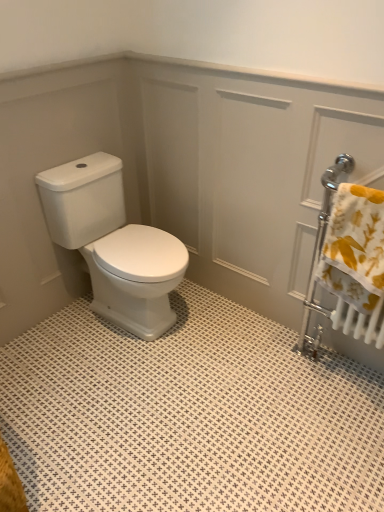
Question: Is white glossy toilet at center facing away from white glossy screen door at center?

Choices:
 (A) yes
 (B) no

Answer: (B)

Question: Does white glossy toilet at center come behind white glossy screen door at center?

Choices:
 (A) no
 (B) yes

Answer: (B)

Question: From the image's perspective, is white glossy toilet at center located beneath white glossy screen door at center?

Choices:
 (A) yes
 (B) no

Answer: (A)

Question: Considering the relative sizes of white glossy toilet at center and white glossy screen door at center in the image provided, is white glossy toilet at center thinner than white glossy screen door at center?

Choices:
 (A) yes
 (B) no

Answer: (B)

Question: Would you say white glossy screen door at center is part of white glossy toilet at center's contents?

Choices:
 (A) yes
 (B) no

Answer: (B)

Question: Considering the positions of yellow floral fabric at right and white glossy toilet at center in the image, is yellow floral fabric at right taller or shorter than white glossy toilet at center?

Choices:
 (A) short
 (B) tall

Answer: (A)

Question: Is yellow floral fabric at right situated inside white glossy toilet at center or outside?

Choices:
 (A) outside
 (B) inside

Answer: (A)

Question: Is yellow floral fabric at right in front of or behind white glossy toilet at center in the image?

Choices:
 (A) front
 (B) behind

Answer: (A)

Question: Is yellow floral fabric at right to the left or to the right of white glossy toilet at center in the image?

Choices:
 (A) left
 (B) right

Answer: (B)

Question: From their relative heights in the image, would you say white glossy toilet at center is taller or shorter than yellow floral fabric at right?

Choices:
 (A) tall
 (B) short

Answer: (A)

Question: Looking at their shapes, would you say white glossy toilet at center is wider or thinner than yellow floral fabric at right?

Choices:
 (A) wide
 (B) thin

Answer: (A)

Question: Visually, is white glossy toilet at center positioned to the left or to the right of yellow floral fabric at right?

Choices:
 (A) left
 (B) right

Answer: (A)

Question: From the image's perspective, is white glossy toilet at center located above or below yellow floral fabric at right?

Choices:
 (A) above
 (B) below

Answer: (A)

Question: Is point (213, 162) positioned closer to the camera than point (134, 293)?

Choices:
 (A) closer
 (B) farther

Answer: (B)

Question: In terms of height, does white glossy screen door at center look taller or shorter compared to white glossy toilet at center?

Choices:
 (A) tall
 (B) short

Answer: (A)